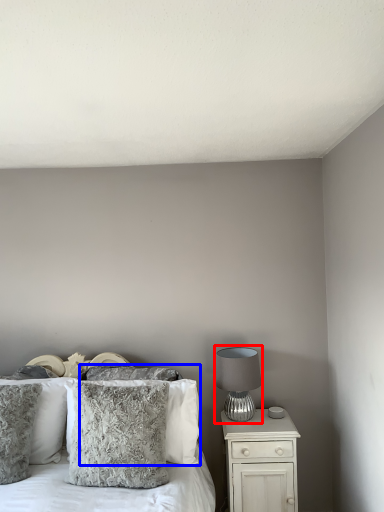
Question: Which of the following is the closest to the observer, table lamp (highlighted by a red box) or pillow (highlighted by a blue box)?

Choices:
 (A) table lamp
 (B) pillow

Answer: (B)